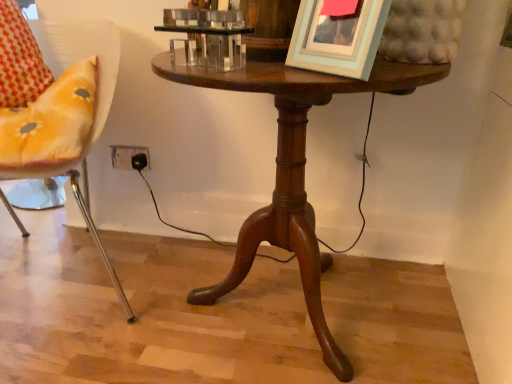
Question: Considering the relative sizes of metallic yellow chair at left and light blue matte picture frame at upper right in the image provided, is metallic yellow chair at left wider than light blue matte picture frame at upper right?

Choices:
 (A) yes
 (B) no

Answer: (A)

Question: From a real-world perspective, does metallic yellow chair at left stand above light blue matte picture frame at upper right?

Choices:
 (A) yes
 (B) no

Answer: (B)

Question: From the image's perspective, is metallic yellow chair at left under light blue matte picture frame at upper right?

Choices:
 (A) no
 (B) yes

Answer: (B)

Question: Is metallic yellow chair at left at the left side of light blue matte picture frame at upper right?

Choices:
 (A) yes
 (B) no

Answer: (A)

Question: Can you confirm if metallic yellow chair at left is positioned to the right of light blue matte picture frame at upper right?

Choices:
 (A) yes
 (B) no

Answer: (B)

Question: Is metallic yellow chair at left shorter than light blue matte picture frame at upper right?

Choices:
 (A) yes
 (B) no

Answer: (B)

Question: Is mahogany wood table at center not inside metallic yellow chair at left?

Choices:
 (A) no
 (B) yes

Answer: (B)

Question: Considering the relative sizes of mahogany wood table at center and metallic yellow chair at left in the image provided, is mahogany wood table at center smaller than metallic yellow chair at left?

Choices:
 (A) yes
 (B) no

Answer: (A)

Question: Could metallic yellow chair at left be considered to be inside mahogany wood table at center?

Choices:
 (A) yes
 (B) no

Answer: (B)

Question: From a real-world perspective, does mahogany wood table at center sit lower than metallic yellow chair at left?

Choices:
 (A) yes
 (B) no

Answer: (A)

Question: Considering the relative sizes of mahogany wood table at center and metallic yellow chair at left in the image provided, is mahogany wood table at center wider than metallic yellow chair at left?

Choices:
 (A) yes
 (B) no

Answer: (B)

Question: Considering the relative positions of mahogany wood table at center and metallic yellow chair at left in the image provided, is mahogany wood table at center to the left of metallic yellow chair at left from the viewer's perspective?

Choices:
 (A) no
 (B) yes

Answer: (A)

Question: Can you confirm if mahogany wood table at center is shorter than light blue matte picture frame at upper right?

Choices:
 (A) yes
 (B) no

Answer: (B)